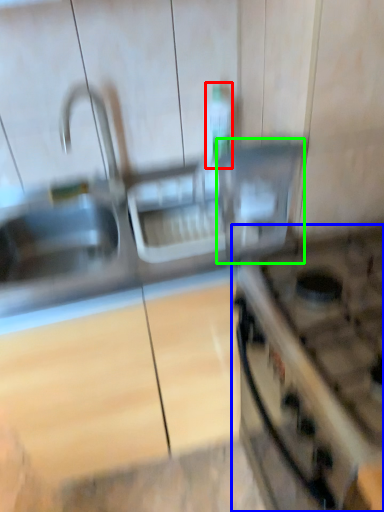
Question: Which object is positioned farthest from bottle (highlighted by a red box)? Select from gas stove (highlighted by a blue box) and appliance (highlighted by a green box).

Choices:
 (A) gas stove
 (B) appliance

Answer: (A)